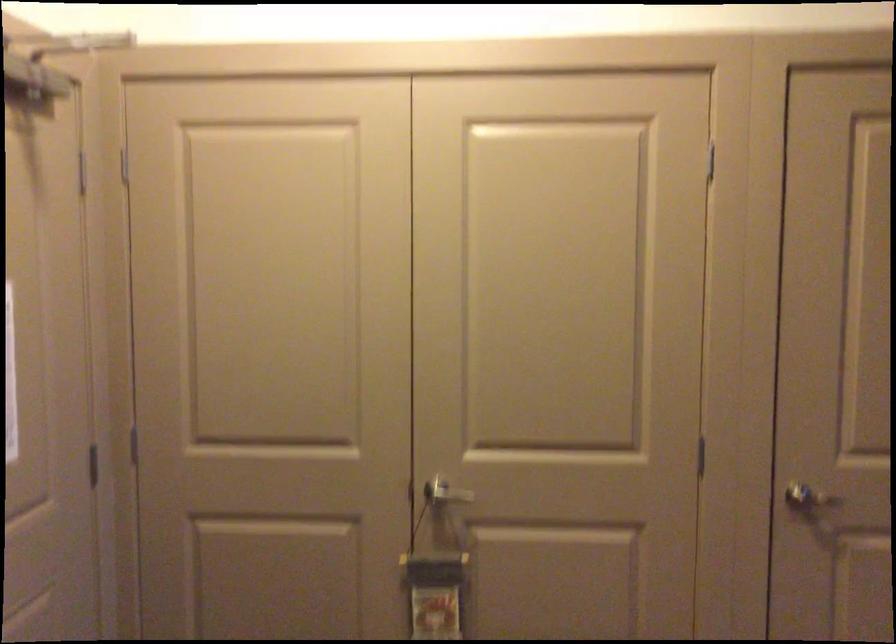
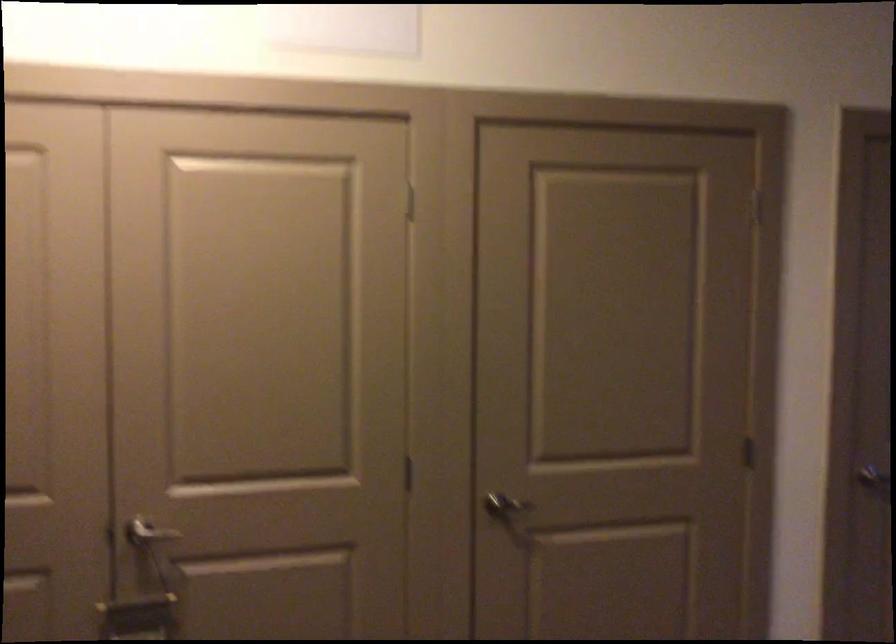
The point at (446, 494) is marked in the first image. Where is the corresponding point in the second image?

(148, 535)